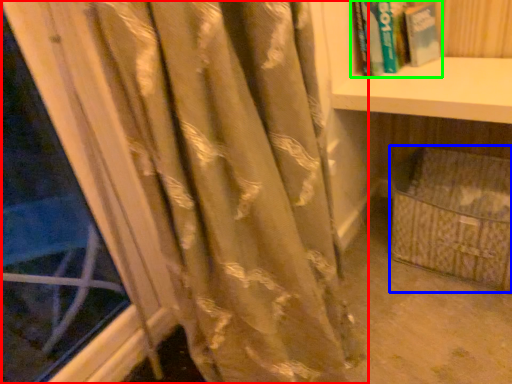
Question: Which object is positioned farthest from curtain (highlighted by a red box)? Select from basket (highlighted by a blue box) and book (highlighted by a green box).

Choices:
 (A) basket
 (B) book

Answer: (B)